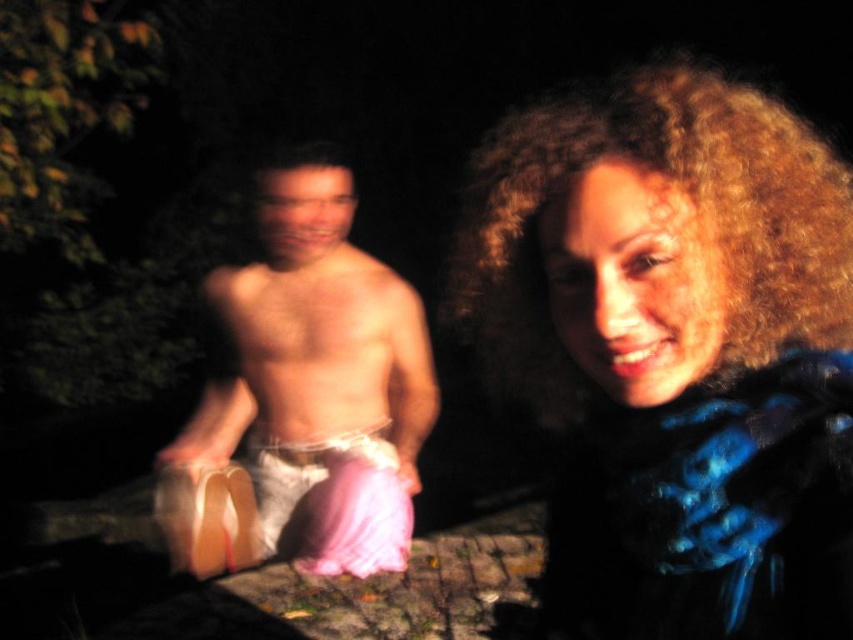
Question: Is curly blonde hair at right positioned at the back of pink satin underwear at lower left?

Choices:
 (A) yes
 (B) no

Answer: (B)

Question: Considering the real-world distances, which object is closest to the pink satin underwear at lower left?

Choices:
 (A) curly blonde hair at right
 (B) pink fabric at left

Answer: (B)

Question: Which point is closer to the camera?

Choices:
 (A) pink fabric at left
 (B) curly blonde hair at right
 (C) pink satin underwear at lower left

Answer: (B)

Question: Estimate the real-world distances between objects in this image. Which object is closer to the pink satin underwear at lower left?

Choices:
 (A) pink fabric at left
 (B) curly blonde hair at right

Answer: (A)

Question: In this image, where is pink fabric at left located relative to pink satin underwear at lower left?

Choices:
 (A) below
 (B) above

Answer: (B)

Question: Considering the relative positions of pink fabric at left and pink satin underwear at lower left in the image provided, where is pink fabric at left located with respect to pink satin underwear at lower left?

Choices:
 (A) above
 (B) below

Answer: (A)